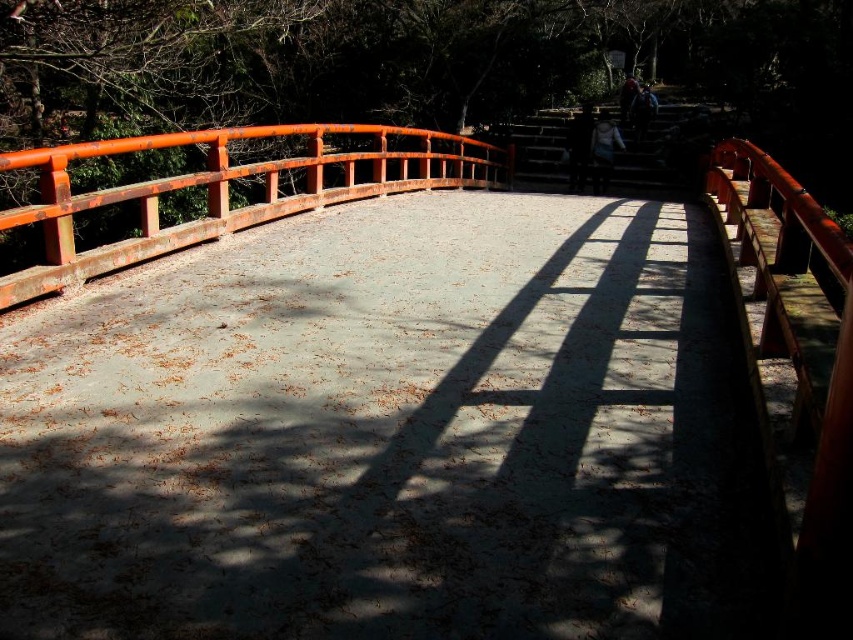
You are a tourist standing at the entrance of a garden and see the smooth concrete path at center and the rustic wood bridge at center. Which object is closer to you?

The smooth concrete path at center is closer to you since it is in front of the rustic wood bridge at center.